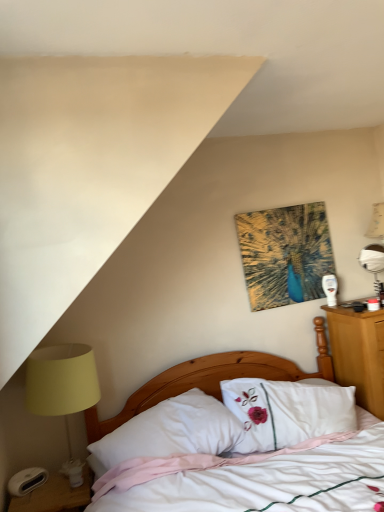
The height and width of the screenshot is (512, 384). What are the coordinates of `free space above white glossy nightstand at lower left (from a real-world perspective)` in the screenshot? It's located at (57, 488).